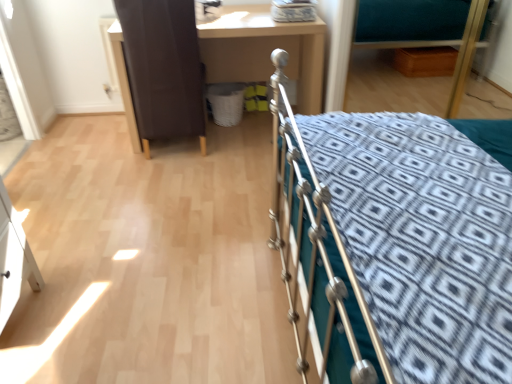
Describe the element at coordinates (392, 245) in the screenshot. I see `silver metallic bed at right` at that location.

Describe the element at coordinates (160, 70) in the screenshot. Image resolution: width=512 pixels, height=384 pixels. I see `brown leather screen door at upper left` at that location.

Image resolution: width=512 pixels, height=384 pixels. I want to click on teal fabric hospital bed at upper right, so click(x=425, y=31).

Measure the distance between point (399, 0) and camera.

Point (399, 0) is 3.36 meters from camera.

In order to click on matte brown desk at center in this screenshot , I will do `click(264, 50)`.

Considering the relative sizes of teal fabric hospital bed at upper right and silver metallic bed at right in the image provided, is teal fabric hospital bed at upper right shorter than silver metallic bed at right?

Indeed, teal fabric hospital bed at upper right has a lesser height compared to silver metallic bed at right.

Is teal fabric hospital bed at upper right far from silver metallic bed at right?

Yes, teal fabric hospital bed at upper right is far from silver metallic bed at right.

Considering the sizes of teal fabric hospital bed at upper right and silver metallic bed at right in the image, is teal fabric hospital bed at upper right bigger or smaller than silver metallic bed at right?

In the image, teal fabric hospital bed at upper right appears to be smaller than silver metallic bed at right.

From the image's perspective, who appears lower, teal fabric hospital bed at upper right or silver metallic bed at right?

silver metallic bed at right, from the image's perspective.

Is matte brown desk at center oriented towards brown leather screen door at upper left?

Yes, matte brown desk at center is facing brown leather screen door at upper left.

Can you confirm if matte brown desk at center is wider than brown leather screen door at upper left?

Yes, matte brown desk at center is wider than brown leather screen door at upper left.

Considering the sizes of objects matte brown desk at center and brown leather screen door at upper left in the image provided, who is taller, matte brown desk at center or brown leather screen door at upper left?

With more height is brown leather screen door at upper left.

From the image's perspective, who appears lower, silver metallic bed at right or teal fabric hospital bed at upper right?

silver metallic bed at right, from the image's perspective.

Does point (430, 285) lie in front of point (370, 19)?

Yes, it is in front of point (370, 19).

What are the coordinates of `bed that is on the left side of teal fabric hospital bed at upper right` in the screenshot? It's located at (392, 245).

Considering the positions of objects silver metallic bed at right and teal fabric hospital bed at upper right in the image provided, who is more to the right, silver metallic bed at right or teal fabric hospital bed at upper right?

teal fabric hospital bed at upper right.

Considering the relative positions of brown leather screen door at upper left and silver metallic bed at right in the image provided, is brown leather screen door at upper left behind silver metallic bed at right?

Yes, it is.

Choose the correct answer: Is brown leather screen door at upper left inside silver metallic bed at right or outside it?

The correct answer is: outside.

From the image's perspective, would you say brown leather screen door at upper left is shown under silver metallic bed at right?

Incorrect, from the image's perspective, brown leather screen door at upper left is higher than silver metallic bed at right.

Is silver metallic bed at right at the back of brown leather screen door at upper left?

That's not correct — brown leather screen door at upper left is not looking away from silver metallic bed at right.

How much distance is there between silver metallic bed at right and brown leather screen door at upper left?

silver metallic bed at right and brown leather screen door at upper left are 1.34 meters apart.

Which point is more distant from viewer, (398, 198) or (138, 69)?

The point (138, 69) is behind.

Is silver metallic bed at right further to the viewer compared to brown leather screen door at upper left?

That is False.

Choose the correct answer: Is silver metallic bed at right inside brown leather screen door at upper left or outside it?

silver metallic bed at right is spatially situated outside brown leather screen door at upper left.

Is silver metallic bed at right aimed at matte brown desk at center?

No, silver metallic bed at right is not aimed at matte brown desk at center.

Identify the location of bed on the right side of matte brown desk at center. The height and width of the screenshot is (384, 512). (392, 245).

Can you tell me how much silver metallic bed at right and matte brown desk at center differ in facing direction?

91.5 degrees separate the facing orientations of silver metallic bed at right and matte brown desk at center.

Considering the relative sizes of silver metallic bed at right and matte brown desk at center in the image provided, is silver metallic bed at right thinner than matte brown desk at center?

Incorrect, the width of silver metallic bed at right is not less than that of matte brown desk at center.

Is matte brown desk at center wider or thinner than teal fabric hospital bed at upper right?

matte brown desk at center is wider than teal fabric hospital bed at upper right.

Is point (234, 33) farther from camera compared to point (457, 87)?

No, (234, 33) is closer to viewer.

From the image's perspective, is matte brown desk at center over teal fabric hospital bed at upper right?

No, from the image's perspective, matte brown desk at center is not above teal fabric hospital bed at upper right.

The width and height of the screenshot is (512, 384). I want to click on hospital bed that is on the right side of silver metallic bed at right, so click(x=425, y=31).

Identify the location of screen door that appears above the matte brown desk at center (from a real-world perspective). (160, 70).

From the image, which object appears to be nearer to matte brown desk at center, silver metallic bed at right or brown leather screen door at upper left?

brown leather screen door at upper left is closer to matte brown desk at center.

In the scene shown: Estimate the real-world distances between objects in this image. Which object is further from silver metallic bed at right, brown leather screen door at upper left or matte brown desk at center?

Among the two, matte brown desk at center is located further to silver metallic bed at right.

Estimate the real-world distances between objects in this image. Which object is further from silver metallic bed at right, brown leather screen door at upper left or teal fabric hospital bed at upper right?

teal fabric hospital bed at upper right is further to silver metallic bed at right.

Which object lies further to the anchor point brown leather screen door at upper left, teal fabric hospital bed at upper right or matte brown desk at center?

teal fabric hospital bed at upper right.

Based on their spatial positions, is matte brown desk at center or brown leather screen door at upper left further from silver metallic bed at right?

Among the two, matte brown desk at center is located further to silver metallic bed at right.

Estimate the real-world distances between objects in this image. Which object is further from brown leather screen door at upper left, matte brown desk at center or silver metallic bed at right?

The object further to brown leather screen door at upper left is silver metallic bed at right.

Looking at the image, which one is located closer to brown leather screen door at upper left, teal fabric hospital bed at upper right or silver metallic bed at right?

silver metallic bed at right is positioned closer to the anchor brown leather screen door at upper left.

Considering their positions, is silver metallic bed at right positioned further to brown leather screen door at upper left than teal fabric hospital bed at upper right?

The object further to brown leather screen door at upper left is teal fabric hospital bed at upper right.

Locate an element on the screen. desk between brown leather screen door at upper left and teal fabric hospital bed at upper right from left to right is located at coordinates (264, 50).

I want to click on screen door between silver metallic bed at right and teal fabric hospital bed at upper right along the z-axis, so click(x=160, y=70).

The width and height of the screenshot is (512, 384). Find the location of `screen door between silver metallic bed at right and matte brown desk at center from front to back`. screen door between silver metallic bed at right and matte brown desk at center from front to back is located at coordinates (160, 70).

Where is `hospital bed positioned between silver metallic bed at right and matte brown desk at center from near to far`? The width and height of the screenshot is (512, 384). hospital bed positioned between silver metallic bed at right and matte brown desk at center from near to far is located at coordinates (425, 31).